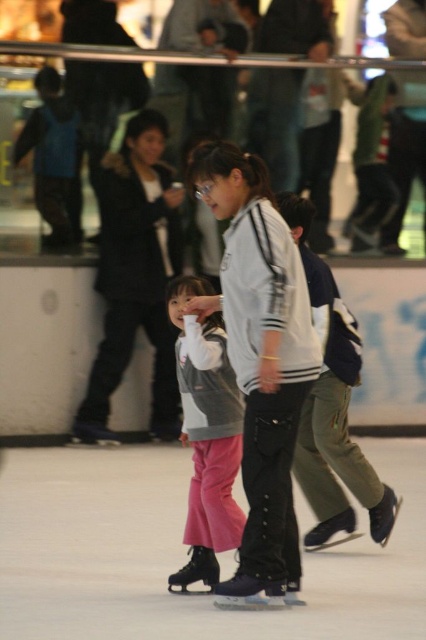
You are a photographer at the ice rink and need to capture a photo of the two children at the center. The pink fabric pants at center and the matte gray vest at center are both in focus. Which child should you adjust the camera settings for to ensure their clothing details are sharp, considering the width difference?

The pink fabric pants at center has a larger width than the matte gray vest at center, so you should adjust the camera settings for the child wearing the pink fabric pants at center to ensure their wider clothing details are captured sharply.

You are a photographer positioned at the entrance of the ice rink. You want to take a photo of the white matte jacket at center. Where should you aim your camera to capture it?

The white matte jacket at center is located at point (259,364), so you should aim your camera at those coordinates to capture it.